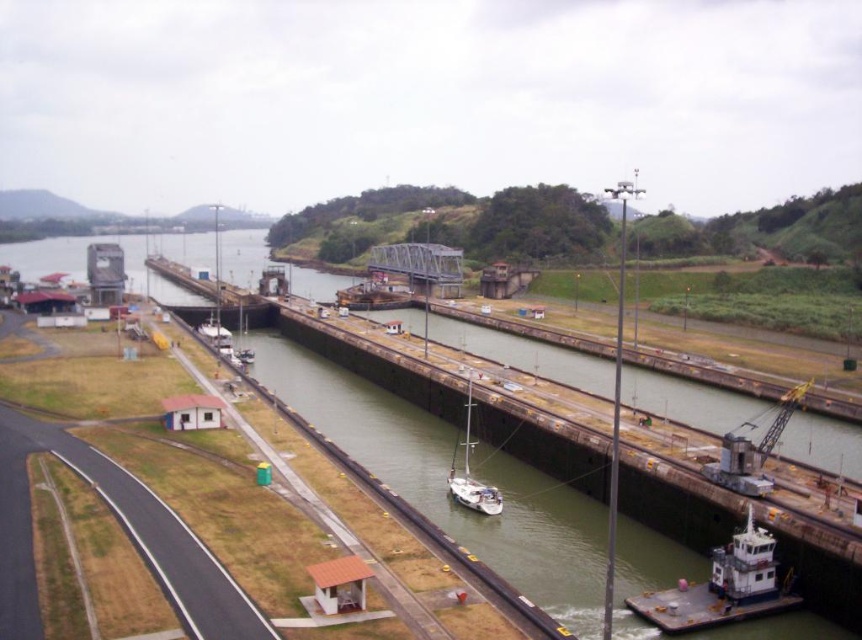
You are a crane operator at the Panama Canal. You need to lift a cargo container onto the white matte sailboat at center. There is also a white matte tugboat at lower right nearby. Considering their heights, which vessel can the crane reach without lowering its height?

The white matte sailboat at center is taller than the white matte tugboat at lower right, so the crane can reach the white matte sailboat at center without lowering its height.

You are a ship captain navigating a narrow lock in the Panama Canal. You see the white matte sailboat at center and the white matte tugboat at lower right. Which vessel is positioned lower in the lock?

The white matte tugboat at lower right is located below the white matte sailboat at center, so it is positioned lower in the lock.